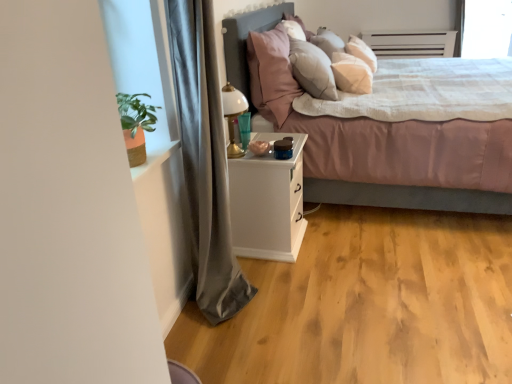
Where is `spots to the right of gray fabric curtain at left`? This screenshot has width=512, height=384. spots to the right of gray fabric curtain at left is located at coordinates (288, 294).